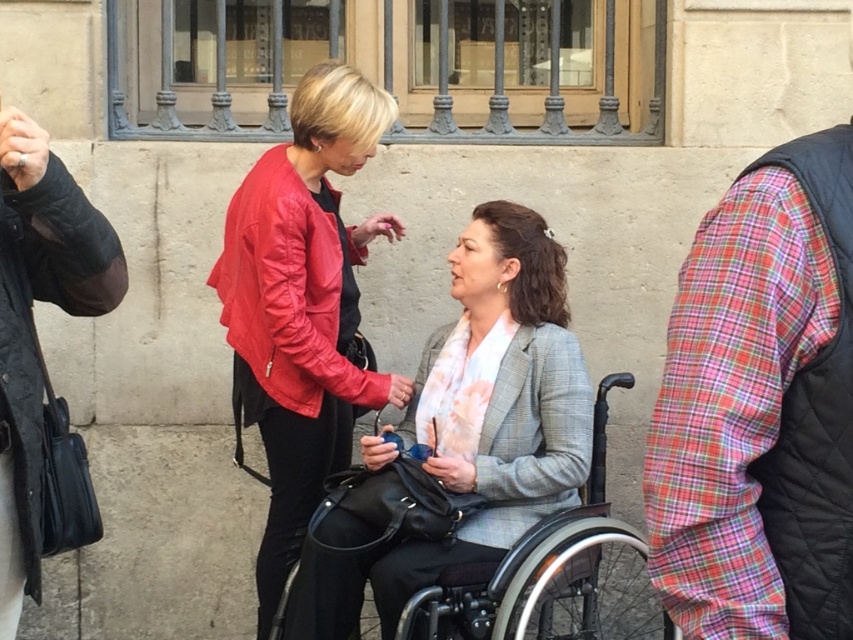
In the scene shown: You are a delivery robot with a 1.5 meter wide package. You need to navigate through the space between the plaid fabric sleeve at right and the matte red leather jacket at center. Can you fit through this space?

The space between the plaid fabric sleeve at right and the matte red leather jacket at center is 2.56 meters. Since the package is 1.5 meters wide, the robot can fit through the space as it is wider than the package.

You are a delivery person who needs to place a small package on the ground between the matte red leather jacket at center and the black plastic wheelchair at center. Is there enough space to place the package without it being under either object?

The matte red leather jacket at center is located above the black plastic wheelchair at center, so there is space between them on the ground to place the package without it being under either object.

You are a fashion stylist observing the two outfits in the scene. The plaid fabric sleeve at right belongs to a person and the matte red leather jacket at center belongs to another. Which outfit is positioned closer to the right side of the image?

The plaid fabric sleeve at right is positioned to the right of the matte red leather jacket at center, so the plaid fabric sleeve at right is closer to the right side of the image.